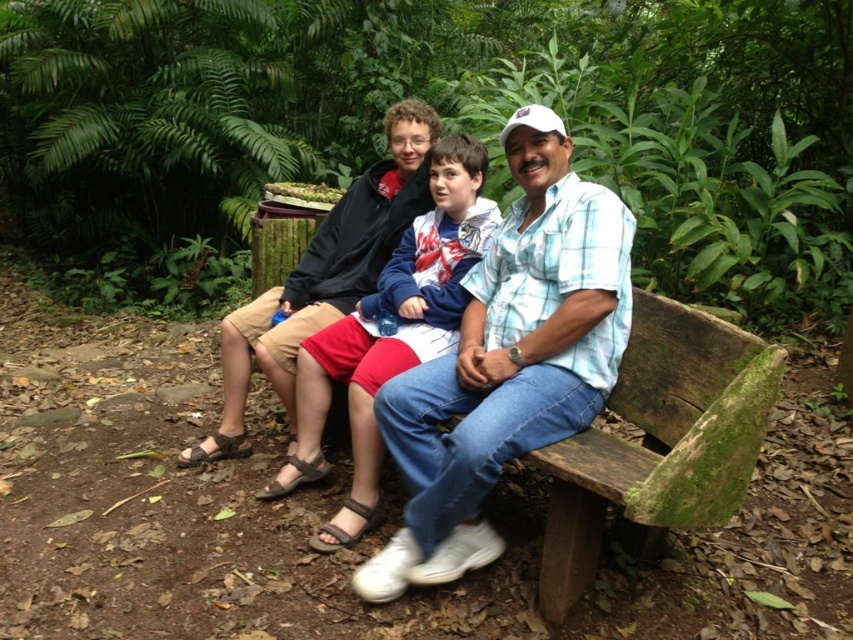
You are planning to place a small potted plant between the green mossy wood bench at right and the blue plaid shirt at center. Given that the plant requires a minimum of 30 cm of space, can you determine if there is enough space between them?

The green mossy wood bench at right is narrower than the blue plaid shirt at center, but the exact distance between them isn generated in the description. Without knowing the actual distance, it is impossible to determine if there is enough space for the plant.